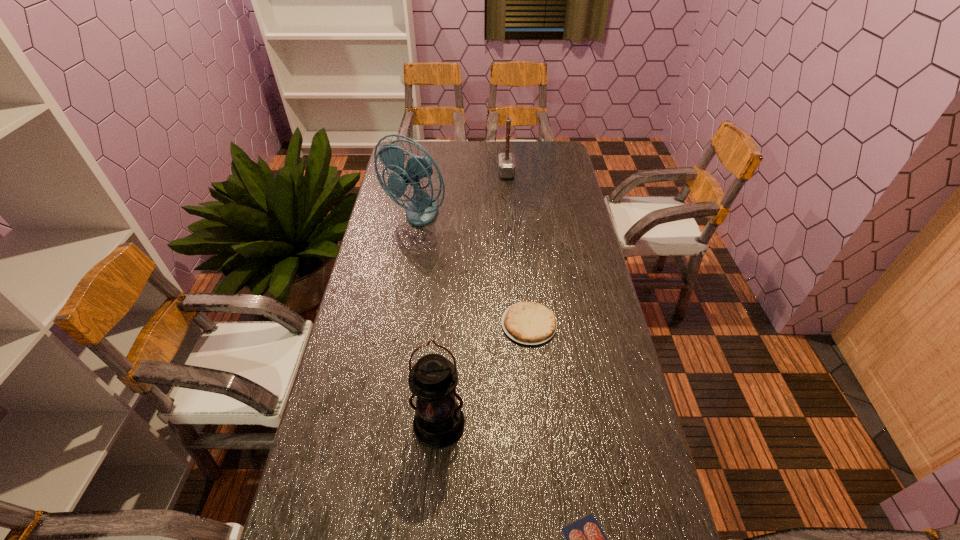
At what (x,y) coordinates should I click in order to perform the action: click on the fourth nearest object. Please return your answer as a coordinate pair (x, y). The image size is (960, 540). Looking at the image, I should click on (422, 209).

The image size is (960, 540). Identify the location of the second nearest object. (439, 422).

The image size is (960, 540). What are the coordinates of `the second tallest object` in the screenshot? It's located at (439, 422).

Where is `the third shortest object`? This screenshot has height=540, width=960. the third shortest object is located at coordinates (506, 162).

At what (x,y) coordinates should I click in order to perform the action: click on the farthest object. Please return your answer as a coordinate pair (x, y). Looking at the image, I should click on (506, 162).

Find the location of a particular element. The height and width of the screenshot is (540, 960). the fourth tallest object is located at coordinates (530, 323).

Where is `the third nearest object`? the third nearest object is located at coordinates (530, 323).

This screenshot has height=540, width=960. What are the coordinates of `free location located in front of the fourth nearest object to blow air` in the screenshot? It's located at (408, 256).

Pinpoint the vacant space located 0.180m above the second nearest object, indicating its light source. Please provide its 2D coordinates. Your answer should be formatted as a tuple, i.e. [(x, y)], where the tuple contains the x and y coordinates of a point satisfying the conditions above.

[(431, 537)]

Identify the location of vacant space located 0.320m on the striking surface of the farthest object. (427, 173).